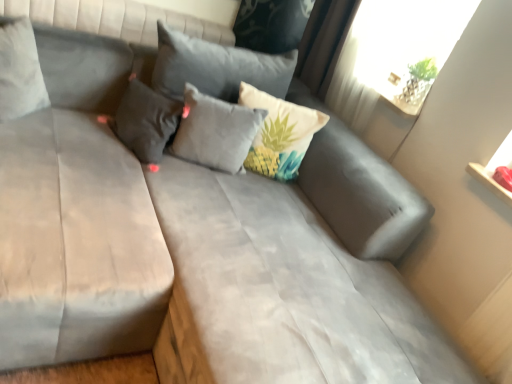
Question: Can you confirm if transparent glass window screen at upper right is thinner than suede gray mattress at left, placed as the 2th mattress when sorted from right to left?

Choices:
 (A) yes
 (B) no

Answer: (A)

Question: Is suede gray mattress at left, the 1th mattress when ordered from left to right, inside transparent glass window screen at upper right?

Choices:
 (A) yes
 (B) no

Answer: (B)

Question: Does transparent glass window screen at upper right lie in front of suede gray mattress at left, the 1th mattress when ordered from left to right?

Choices:
 (A) no
 (B) yes

Answer: (A)

Question: Is transparent glass window screen at upper right turned away from suede gray mattress at left, the 1th mattress when ordered from left to right?

Choices:
 (A) no
 (B) yes

Answer: (A)

Question: Does transparent glass window screen at upper right have a lesser height compared to suede gray mattress at left, the 1th mattress when ordered from left to right?

Choices:
 (A) yes
 (B) no

Answer: (A)

Question: From the image's perspective, does transparent glass window screen at upper right appear higher than suede gray mattress at left, the 1th mattress when ordered from left to right?

Choices:
 (A) yes
 (B) no

Answer: (A)

Question: From the image's perspective, is suede gray mattress at center, the second mattress from the left, beneath transparent glass window screen at upper right?

Choices:
 (A) yes
 (B) no

Answer: (A)

Question: Considering the relative sizes of suede gray mattress at center, the second mattress from the left, and transparent glass window screen at upper right in the image provided, is suede gray mattress at center, the second mattress from the left, shorter than transparent glass window screen at upper right?

Choices:
 (A) no
 (B) yes

Answer: (A)

Question: From a real-world perspective, does suede gray mattress at center, the 1th mattress when ordered from right to left, sit lower than transparent glass window screen at upper right?

Choices:
 (A) no
 (B) yes

Answer: (B)

Question: Can you confirm if suede gray mattress at center, the second mattress from the left, is bigger than transparent glass window screen at upper right?

Choices:
 (A) no
 (B) yes

Answer: (B)

Question: Is suede gray mattress at center, the second mattress from the left, positioned behind transparent glass window screen at upper right?

Choices:
 (A) no
 (B) yes

Answer: (A)

Question: Considering the relative positions of suede gray mattress at center, the 1th mattress when ordered from right to left, and transparent glass window screen at upper right in the image provided, is suede gray mattress at center, the 1th mattress when ordered from right to left, to the left of transparent glass window screen at upper right from the viewer's perspective?

Choices:
 (A) no
 (B) yes

Answer: (B)

Question: From a real-world perspective, is light gray fabric pillow at center, the 2th pillow when ordered from right to left, located higher than transparent glass window screen at upper right?

Choices:
 (A) no
 (B) yes

Answer: (A)